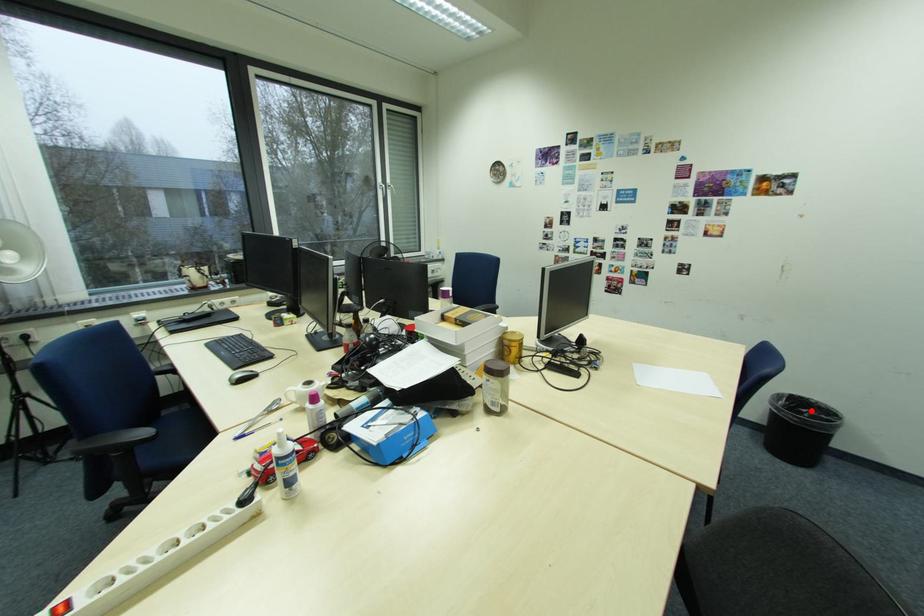
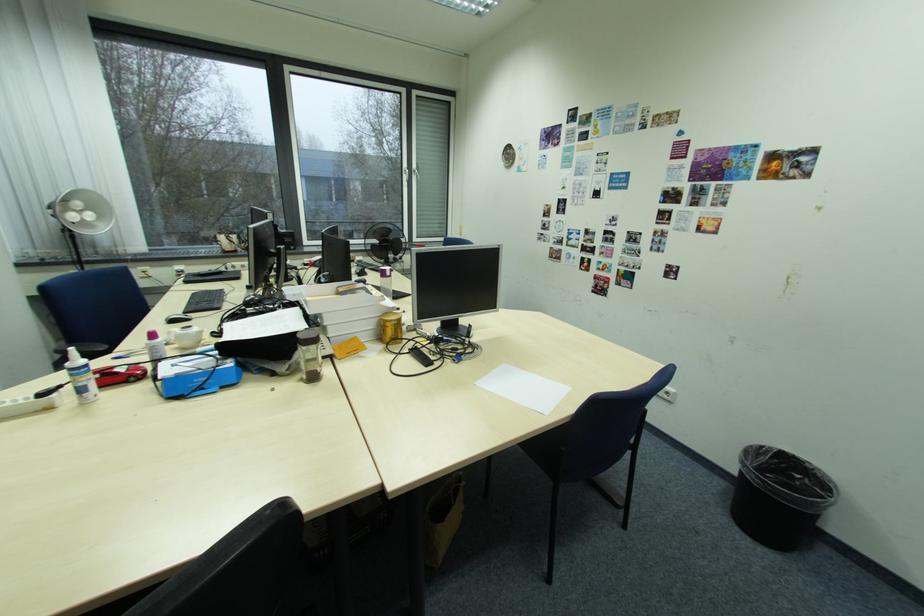
Locate, in the second image, the point that corresponds to the highlighted location in the first image.

(807, 477)